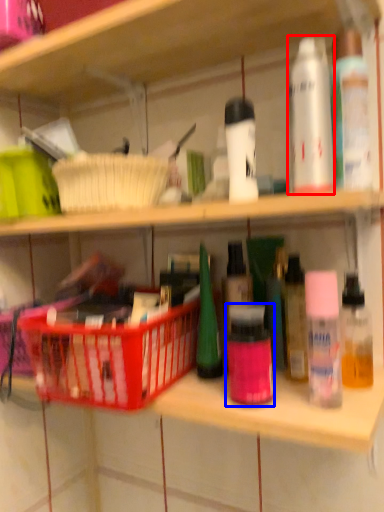
Question: Which object appears closest to the camera in this image, mouthwash (highlighted by a red box) or toiletry (highlighted by a blue box)?

Choices:
 (A) mouthwash
 (B) toiletry

Answer: (A)